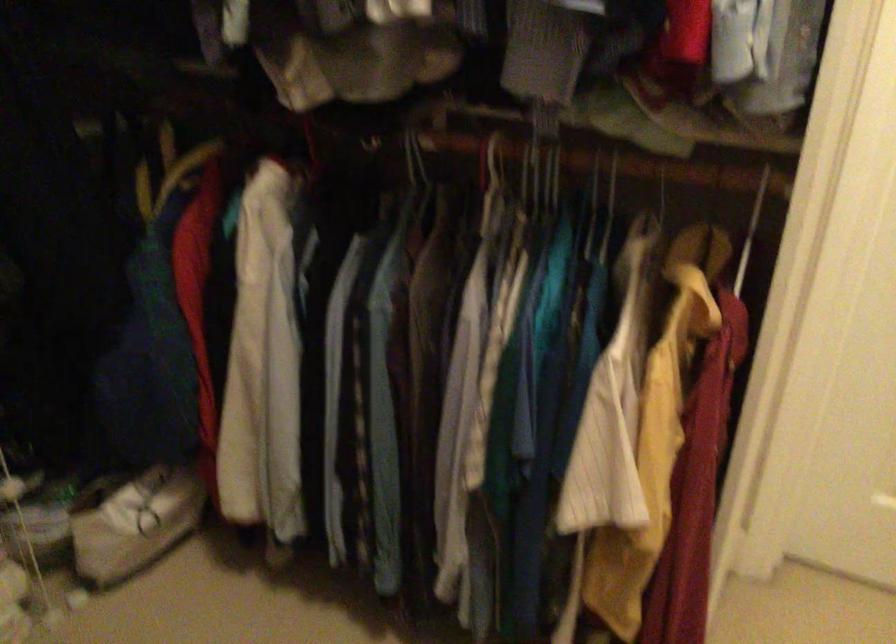
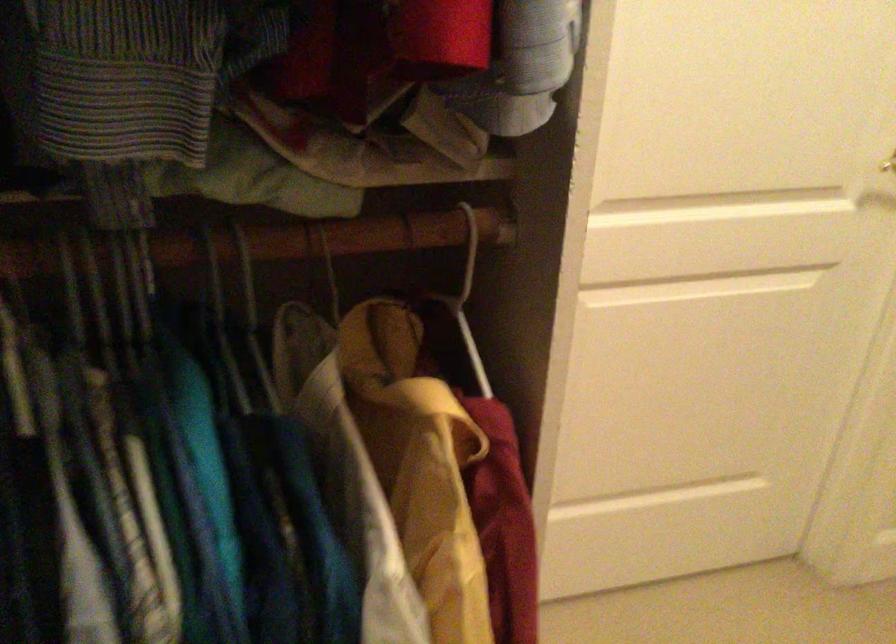
The point at (609, 210) is marked in the first image. Where is the corresponding point in the second image?

(174, 296)